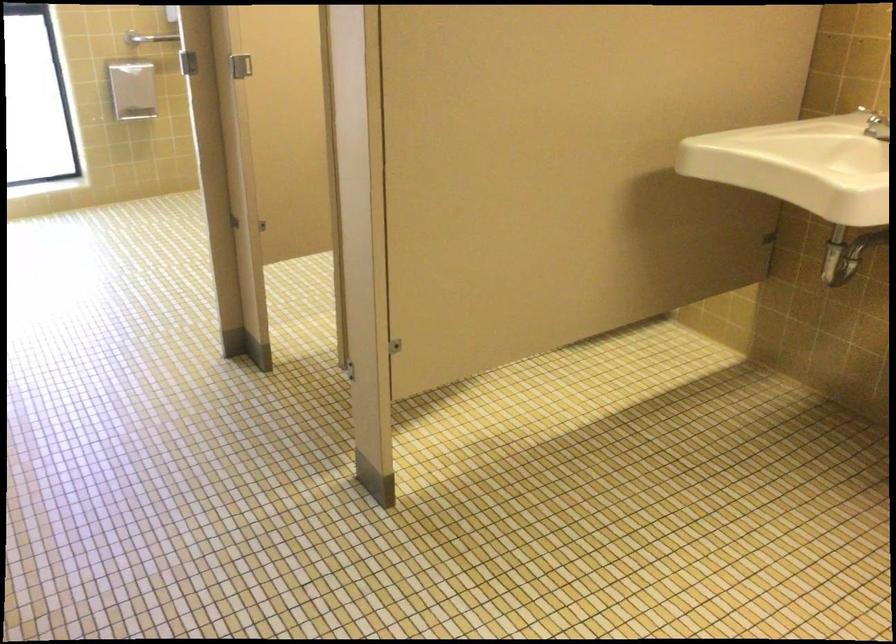
Find where to lift the silver faucet handle. Please return your answer as a coordinate pair (x, y).

(874, 124)